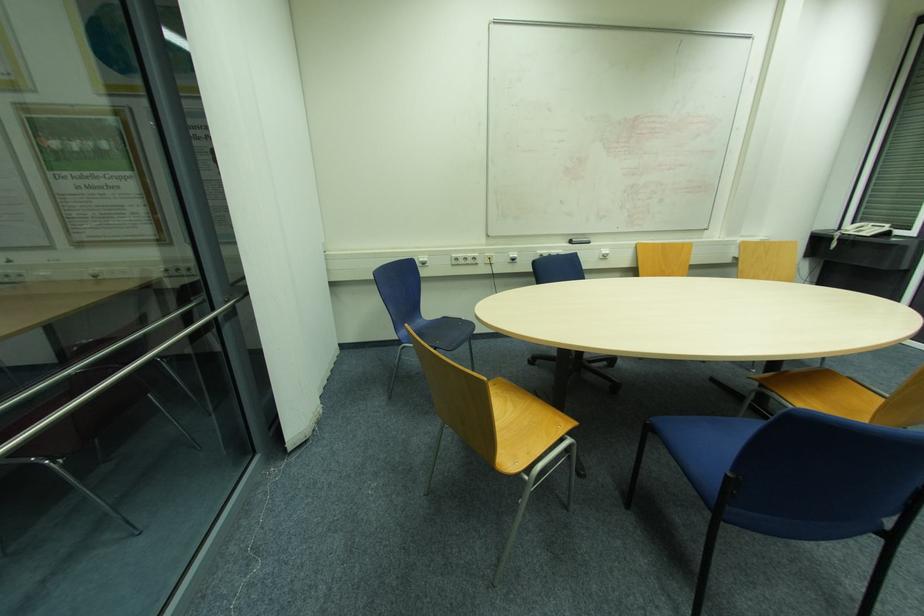
Find where to lift the telephone handset. Please return your answer as a coordinate pair (x, y).

(864, 228)